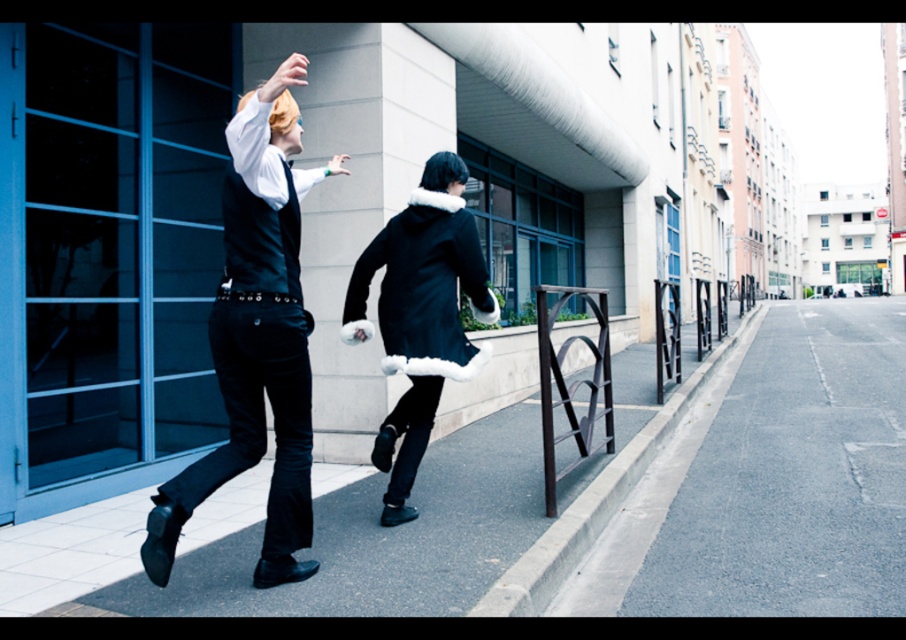
You are a delivery person trying to avoid potholes. You see the gray asphalt pavement at center and the black asphalt at center. Which one is positioned to the right side of the other?

The gray asphalt pavement at center is to the right of the black asphalt at center.

Consider the image. You are standing on the gray asphalt pavement at center. You want to walk to the point marked as point (770, 481). Is the point on the same surface you are currently standing on?

Yes, the point (770, 481) is on the gray asphalt pavement at center, so it is on the same surface you are currently standing on.